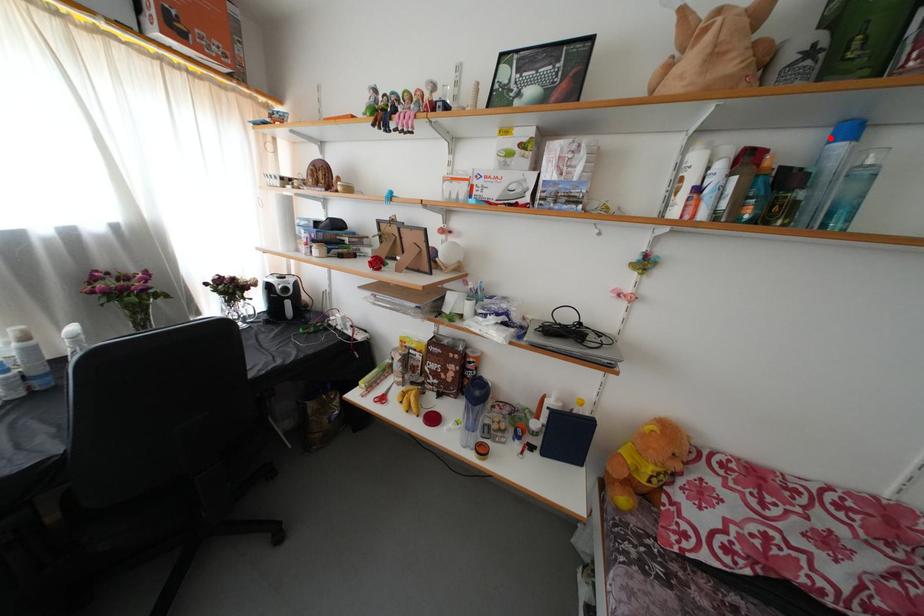
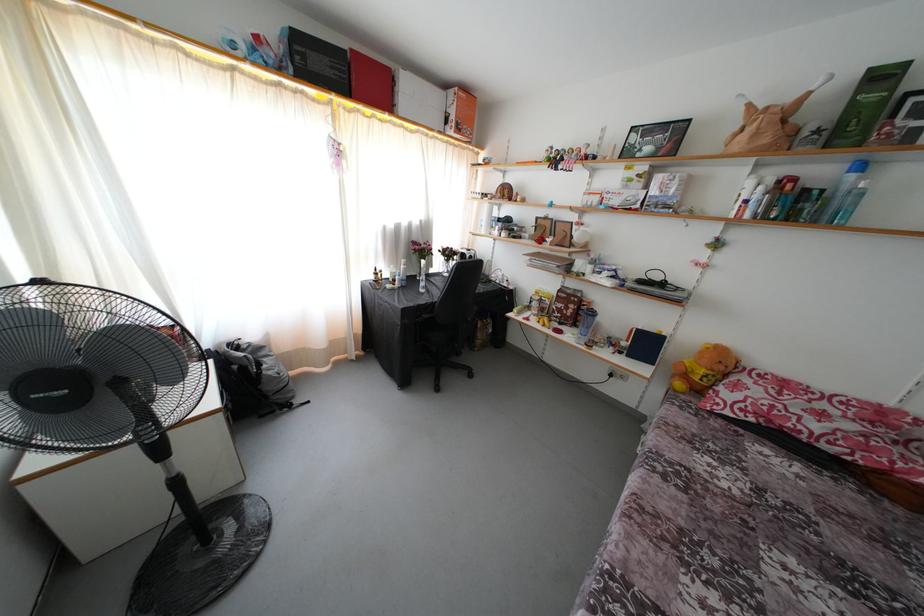
Locate, in the second image, the point that corresponds to the highlighted location in the first image.

(849, 172)